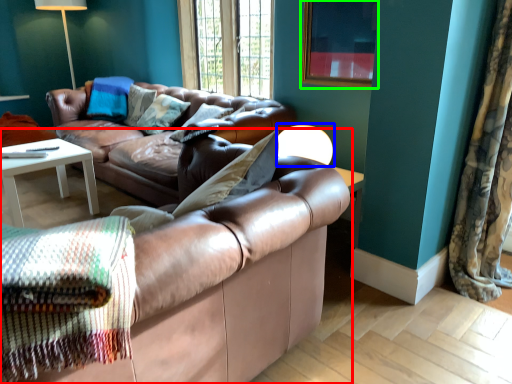
Question: Which object is positioned farthest from studio couch (highlighted by a red box)? Select from table lamp (highlighted by a blue box) and picture frame (highlighted by a green box).

Choices:
 (A) table lamp
 (B) picture frame

Answer: (B)